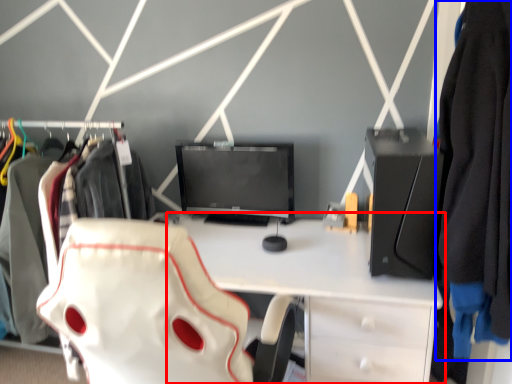
Question: Which object appears farthest to the camera in this image, desk (highlighted by a red box) or clothing (highlighted by a blue box)?

Choices:
 (A) desk
 (B) clothing

Answer: (A)